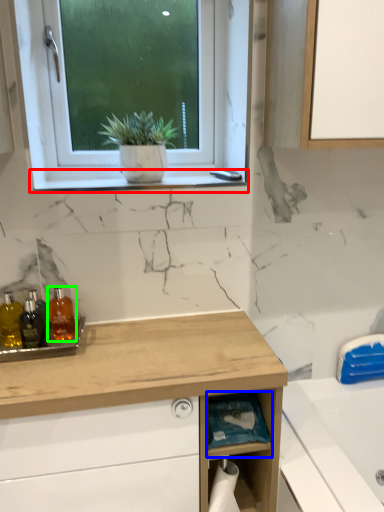
Question: Which object is the closest to the window sill (highlighted by a red box)? Choose among these: shelf (highlighted by a blue box) or toiletry (highlighted by a green box).

Choices:
 (A) shelf
 (B) toiletry

Answer: (B)